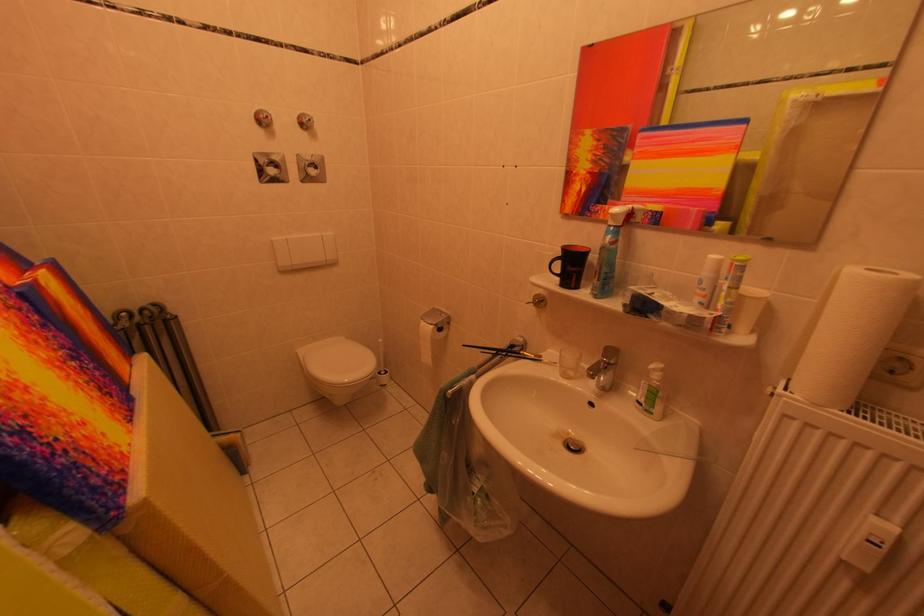
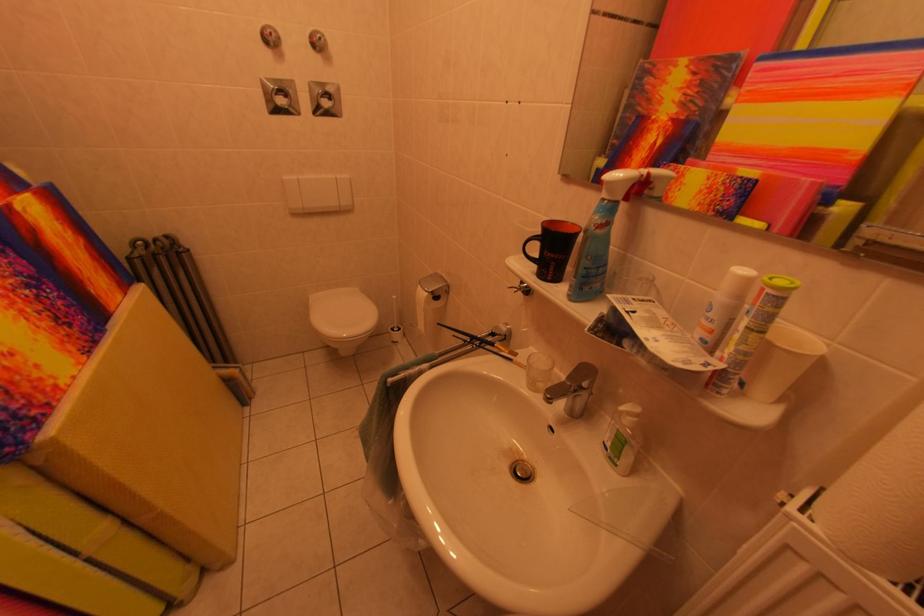
Locate, in the second image, the point that corresponds to (572,222) in the first image.

(569, 184)